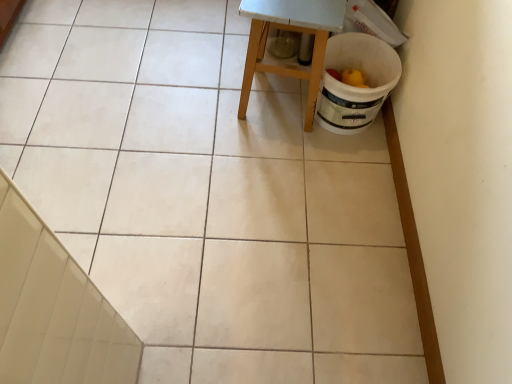
This screenshot has width=512, height=384. I want to click on vacant space that is to the left of wooden stool at center, so click(201, 105).